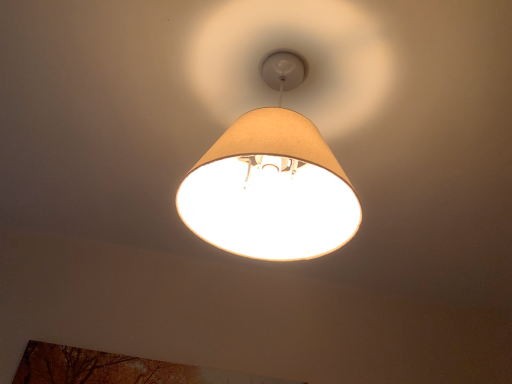
Question: From the image's perspective, is autumn leaves painting at lower left located above or below beige fabric lampshade at center?

Choices:
 (A) below
 (B) above

Answer: (A)

Question: Would you say autumn leaves painting at lower left is to the left or to the right of beige fabric lampshade at center in the picture?

Choices:
 (A) left
 (B) right

Answer: (A)

Question: In terms of height, does autumn leaves painting at lower left look taller or shorter compared to beige fabric lampshade at center?

Choices:
 (A) short
 (B) tall

Answer: (A)

Question: In terms of height, does beige fabric lampshade at center look taller or shorter compared to autumn leaves painting at lower left?

Choices:
 (A) tall
 (B) short

Answer: (A)

Question: Is point (302, 185) closer or farther from the camera than point (110, 380)?

Choices:
 (A) farther
 (B) closer

Answer: (B)

Question: From the image's perspective, is beige fabric lampshade at center located above or below autumn leaves painting at lower left?

Choices:
 (A) below
 (B) above

Answer: (B)

Question: Is beige fabric lampshade at center inside or outside of autumn leaves painting at lower left?

Choices:
 (A) inside
 (B) outside

Answer: (B)